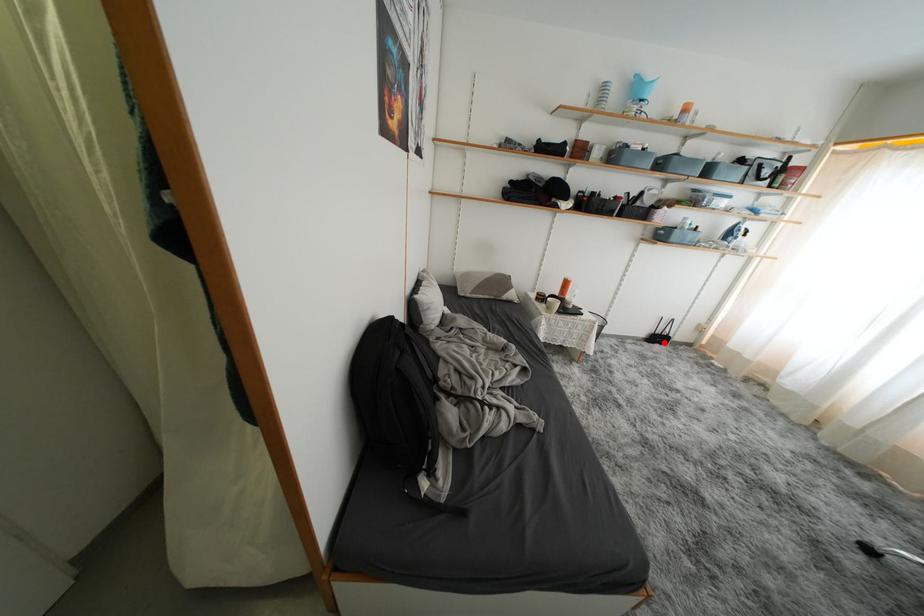
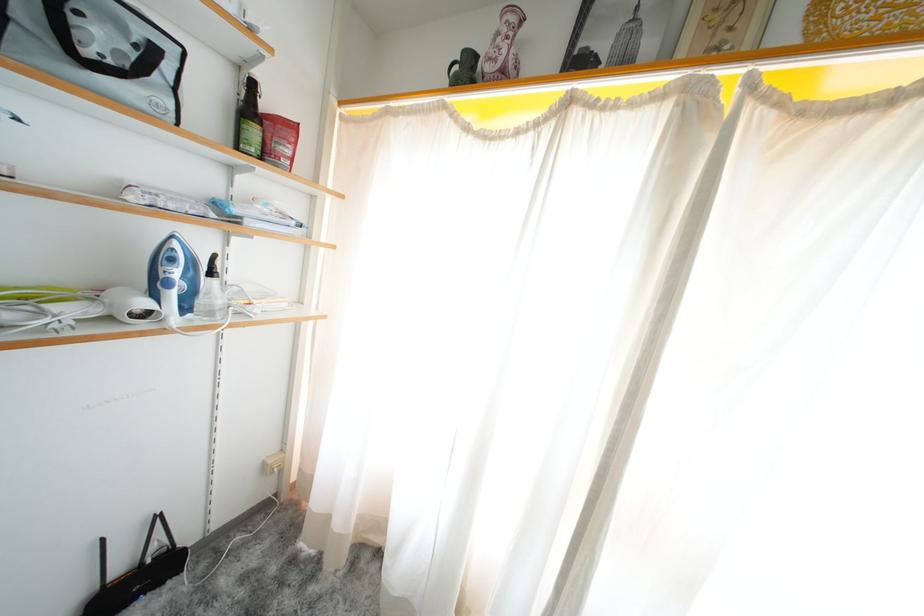
Where in the second image is the point corresponding to the highlighted location from the first image?

(143, 586)